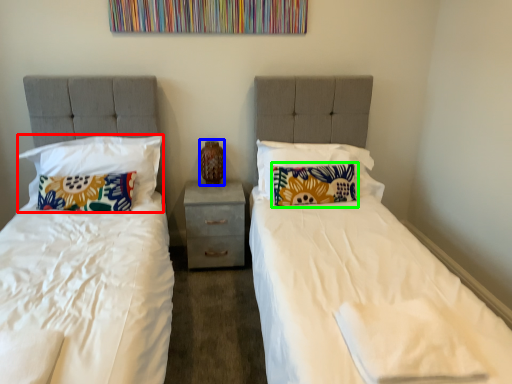
Question: Based on their relative distances, which object is nearer to pillow (highlighted by a red box)? Choose from vase (highlighted by a blue box) and pillow (highlighted by a green box).

Choices:
 (A) vase
 (B) pillow

Answer: (A)